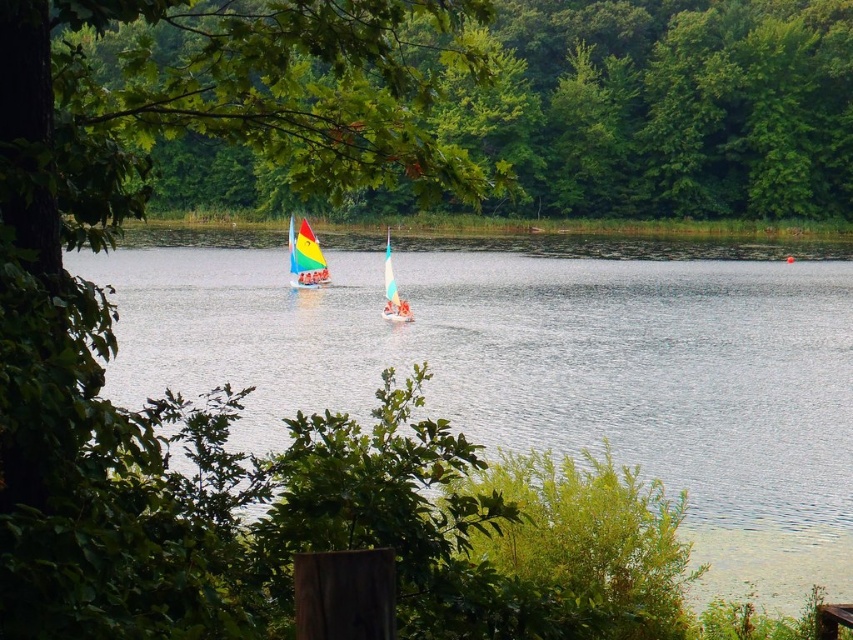
Is rainbow sailboat at center shorter than white plastic sailboat at center?

Indeed, rainbow sailboat at center has a lesser height compared to white plastic sailboat at center.

Is point (289, 227) closer to camera compared to point (386, 284)?

No.

Where is `rainbow sailboat at center`? rainbow sailboat at center is located at coordinates (305, 257).

How far apart are clear water at center and white plastic sailboat at center?

The distance of clear water at center from white plastic sailboat at center is 14.50 meters.

In the scene shown: Can you confirm if clear water at center is wider than white plastic sailboat at center?

Yes, clear water at center is wider than white plastic sailboat at center.

Between point (397, 272) and point (393, 300), which one is positioned in front?

Point (393, 300)

Where is `clear water at center`? The width and height of the screenshot is (853, 640). clear water at center is located at coordinates (543, 364).

Is clear water at center below green leafy tree at upper center?

Yes, clear water at center is below green leafy tree at upper center.

Is point (566, 413) more distant than point (646, 68)?

No, it is in front of (646, 68).

Find the location of a particular element. clear water at center is located at coordinates (543, 364).